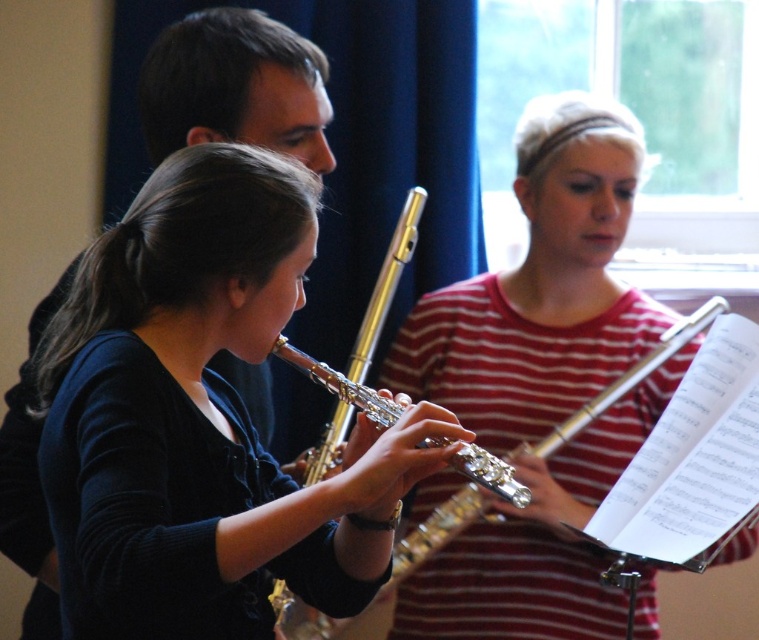
Does metallic flute at center have a lesser width compared to silver metallic flute at center?

In fact, metallic flute at center might be wider than silver metallic flute at center.

Is metallic flute at center wider than silver metallic flute at center?

Yes.

The width and height of the screenshot is (759, 640). What do you see at coordinates (540, 285) in the screenshot?
I see `metallic flute at center` at bounding box center [540, 285].

Locate an element on the screen. metallic flute at center is located at coordinates (540, 285).

Based on the photo, is matte gold flute at center wider than silver metallic flute at center?

Correct, the width of matte gold flute at center exceeds that of silver metallic flute at center.

Is point (295, 262) farther from viewer compared to point (301, 365)?

No, it is not.

This screenshot has height=640, width=759. Describe the element at coordinates (200, 419) in the screenshot. I see `matte gold flute at center` at that location.

The width and height of the screenshot is (759, 640). Find the location of `matte gold flute at center`. matte gold flute at center is located at coordinates (200, 419).

Describe the element at coordinates (200, 419) in the screenshot. I see `matte gold flute at center` at that location.

Between point (93, 374) and point (474, 364), which one is positioned in front?

Point (93, 374)

Is point (254, 438) closer to viewer compared to point (427, 333)?

Yes, it is.

At what (x,y) coordinates should I click in order to perform the action: click on matte gold flute at center. Please return your answer as a coordinate pair (x, y). This screenshot has height=640, width=759. Looking at the image, I should click on (200, 419).